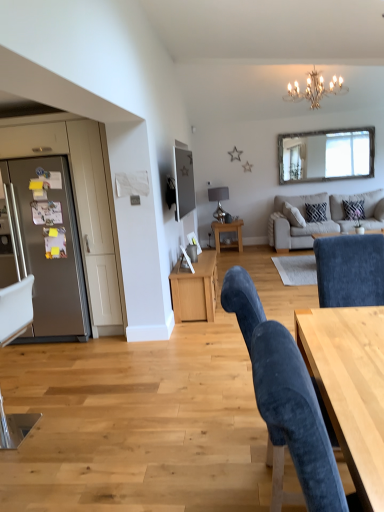
You are a GUI agent. You are given a task and a screenshot of the screen. Output one action in this format:
    pyautogui.click(x=<x>, y=<y>)
    Task: Click on the free location to the right of metallic silver chair at left, the first chair when ordered from left to right
    This screenshot has height=512, width=384.
    Given the screenshot: What is the action you would take?
    pyautogui.click(x=75, y=426)